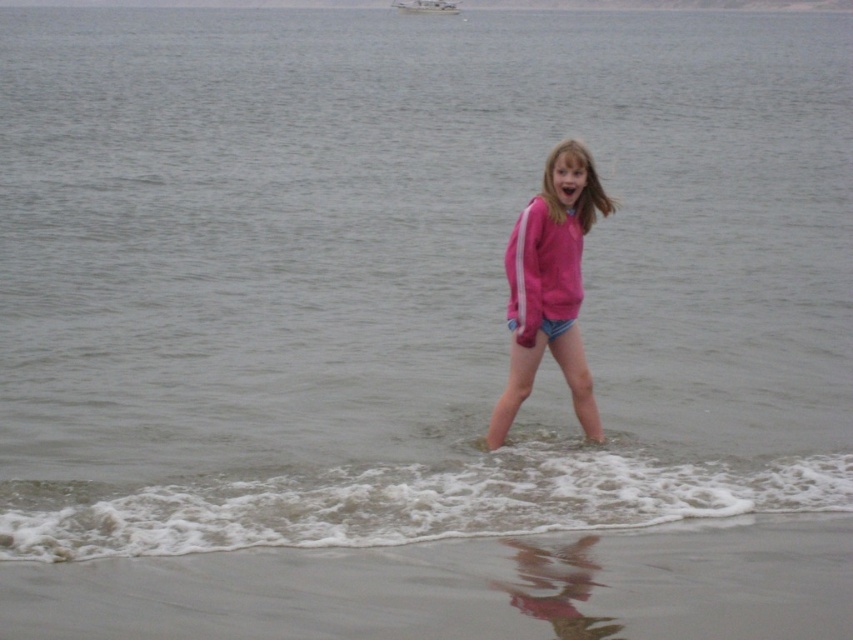
Which of these two, sandy beach at lower center or white plastic boat at upper center, stands shorter?

With less height is white plastic boat at upper center.

Who is more distant from viewer, (838, 528) or (393, 4)?

Positioned behind is point (393, 4).

Between point (776, 637) and point (434, 3), which one is positioned in front?

Positioned in front is point (776, 637).

Find the location of a particular element. This screenshot has width=853, height=640. sandy beach at lower center is located at coordinates (462, 588).

Can you confirm if pink fabric shorts at center is shorter than white plastic boat at upper center?

No.

Does pink fabric shorts at center lie behind white plastic boat at upper center?

No, it is in front of white plastic boat at upper center.

The width and height of the screenshot is (853, 640). What do you see at coordinates (550, 285) in the screenshot?
I see `pink fabric shorts at center` at bounding box center [550, 285].

I want to click on pink fabric shorts at center, so click(550, 285).

Can you confirm if sandy beach at lower center is positioned to the right of pink fabric shorts at center?

Incorrect, sandy beach at lower center is not on the right side of pink fabric shorts at center.

Can you confirm if sandy beach at lower center is shorter than pink fabric shorts at center?

Indeed, sandy beach at lower center has a lesser height compared to pink fabric shorts at center.

Where is `sandy beach at lower center`? Image resolution: width=853 pixels, height=640 pixels. sandy beach at lower center is located at coordinates (462, 588).